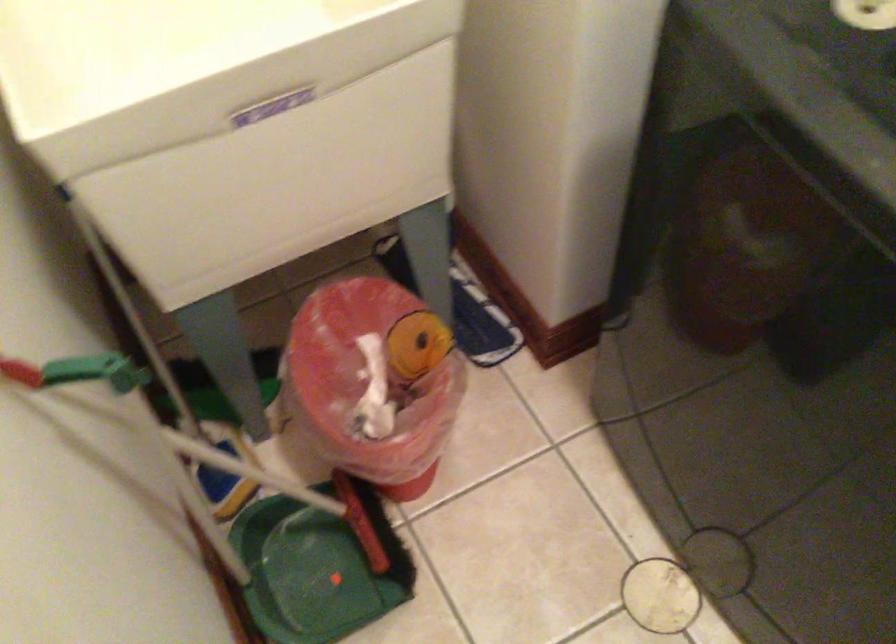
At what (x,y) coordinates should I click in order to perform the action: click on white broom handle. Please return your answer as a coordinate pair (x, y). The image size is (896, 644). Looking at the image, I should click on (228, 462).